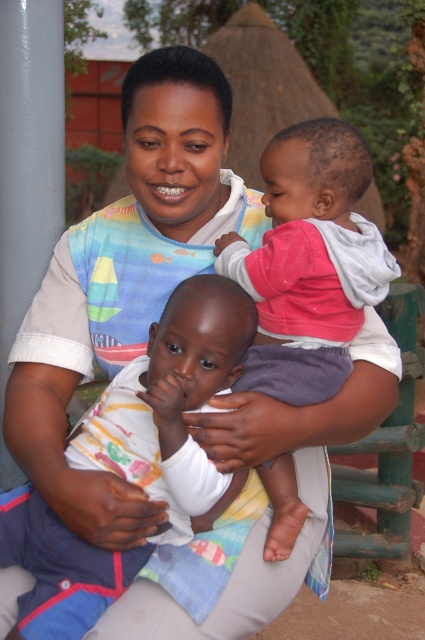
Is point (90, 579) more distant than point (218, 269)?

No.

Is white cotton shirt at center shorter than soft pink fabric at upper right?

Yes.

Between point (161, 321) and point (368, 262), which one is positioned in front?

Positioned in front is point (161, 321).

I want to click on white cotton shirt at center, so click(x=178, y=392).